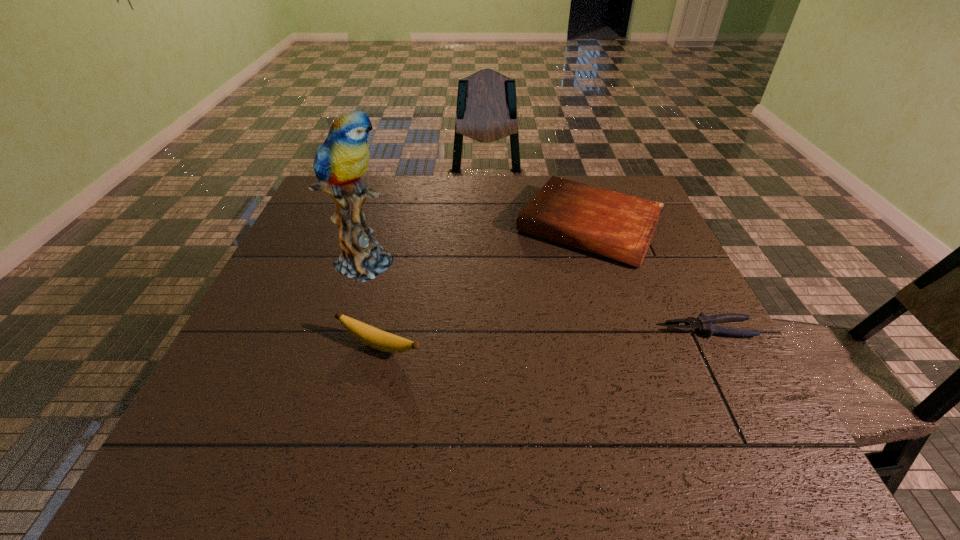
Identify the location of vacant space at the near edge of the desktop. (660, 406).

At what (x,y) coordinates should I click in order to perform the action: click on vacant space at the left edge of the desktop. Please return your answer as a coordinate pair (x, y). This screenshot has width=960, height=540. Looking at the image, I should click on (306, 286).

Find the location of a particular element. This screenshot has width=960, height=540. vacant area at the right edge is located at coordinates (669, 293).

At what (x,y) coordinates should I click in order to perform the action: click on vacant space at the far left corner of the desktop. Please return your answer as a coordinate pair (x, y). The height and width of the screenshot is (540, 960). Looking at the image, I should click on (366, 178).

Where is `free space at the far right corner`? The width and height of the screenshot is (960, 540). free space at the far right corner is located at coordinates (632, 192).

I want to click on free area in between the tallest object and the Bible, so click(478, 244).

Identify the location of free space that is in between the parrot and the banana. (373, 303).

Locate an element on the screen. free space that is in between the banana and the Bible is located at coordinates (485, 287).

The height and width of the screenshot is (540, 960). I want to click on free space between the pliers and the Bible, so click(649, 278).

At what (x,y) coordinates should I click in order to perform the action: click on free space that is in between the Bible and the parrot. Please return your answer as a coordinate pair (x, y). Looking at the image, I should click on (478, 244).